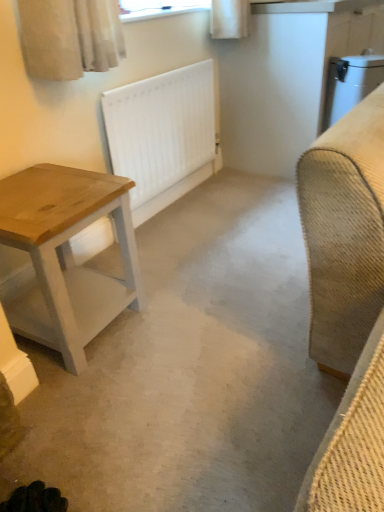
Question: From the image's perspective, would you say white matte radiator at center is shown under wooden table at left?

Choices:
 (A) no
 (B) yes

Answer: (A)

Question: Is white matte radiator at center thinner than wooden table at left?

Choices:
 (A) yes
 (B) no

Answer: (A)

Question: Is white matte radiator at center looking in the opposite direction of wooden table at left?

Choices:
 (A) yes
 (B) no

Answer: (B)

Question: Is white matte radiator at center wider than wooden table at left?

Choices:
 (A) no
 (B) yes

Answer: (A)

Question: Is the depth of white matte radiator at center greater than that of wooden table at left?

Choices:
 (A) no
 (B) yes

Answer: (B)

Question: From their relative heights in the image, would you say wooden table at left is taller or shorter than white matte radiator at center?

Choices:
 (A) short
 (B) tall

Answer: (A)

Question: Is wooden table at left to the left or to the right of white matte radiator at center in the image?

Choices:
 (A) right
 (B) left

Answer: (B)

Question: Is wooden table at left bigger or smaller than white matte radiator at center?

Choices:
 (A) big
 (B) small

Answer: (A)

Question: Is wooden table at left wider or thinner than white matte radiator at center?

Choices:
 (A) thin
 (B) wide

Answer: (B)

Question: In terms of height, does white matte radiator at center look taller or shorter compared to wooden table at left?

Choices:
 (A) tall
 (B) short

Answer: (A)

Question: From the image's perspective, is white matte radiator at center positioned above or below wooden table at left?

Choices:
 (A) above
 (B) below

Answer: (A)

Question: Is white matte radiator at center inside the boundaries of wooden table at left, or outside?

Choices:
 (A) outside
 (B) inside

Answer: (A)

Question: Is white matte radiator at center bigger or smaller than wooden table at left?

Choices:
 (A) small
 (B) big

Answer: (A)

Question: Would you say white matte concrete at center is to the left or to the right of white matte radiator at center in the picture?

Choices:
 (A) right
 (B) left

Answer: (A)

Question: Looking at the image, does white matte concrete at center seem bigger or smaller compared to white matte radiator at center?

Choices:
 (A) small
 (B) big

Answer: (B)